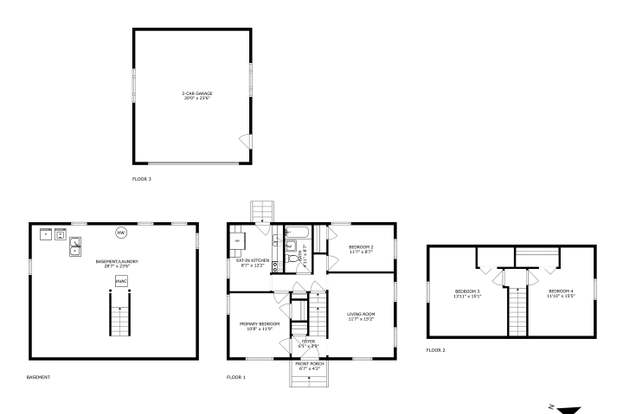
The image size is (623, 414). In order to click on basement in this screenshot , I will do `click(81, 332)`.